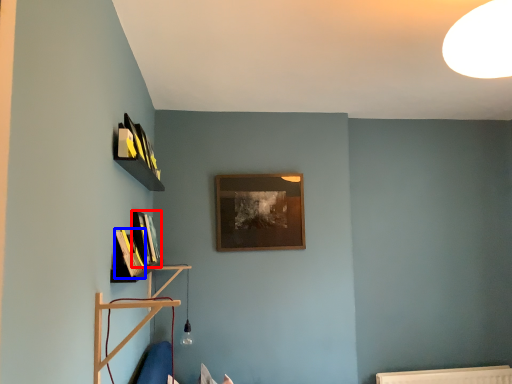
Question: Which of the following is the closest to the observer, book (highlighted by a red box) or book (highlighted by a blue box)?

Choices:
 (A) book
 (B) book

Answer: (B)